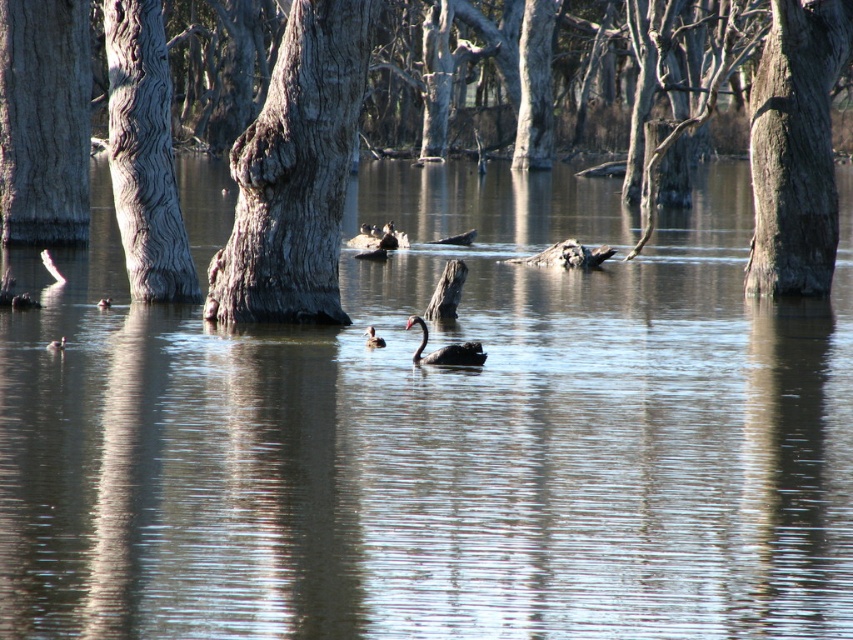
Question: Which of these objects is positioned closest to the brown matte duck at left?

Choices:
 (A) gray textured tree trunk at center
 (B) gray textured tree trunk at left
 (C) rough bark tree trunk at upper right
 (D) brown fuzzy duck at center

Answer: (D)

Question: Which object is the closest to the brown matte duck at center?

Choices:
 (A) brown matte duck at left
 (B) gray textured tree trunk at center
 (C) brown wood tree at center

Answer: (B)

Question: Is rough bark tree trunk at upper right to the right of brown fuzzy duck at center from the viewer's perspective?

Choices:
 (A) yes
 (B) no

Answer: (A)

Question: Considering the real-world distances, which object is closest to the black glossy duck at center?

Choices:
 (A) brown wood tree at center
 (B) brown matte duck at lower left

Answer: (B)

Question: Does brown wood tree at center have a smaller size compared to brown matte duck at center?

Choices:
 (A) no
 (B) yes

Answer: (A)

Question: Observing the image, what is the correct spatial positioning of brown wood tree at center in reference to rough bark tree trunk at upper right?

Choices:
 (A) above
 (B) below

Answer: (A)